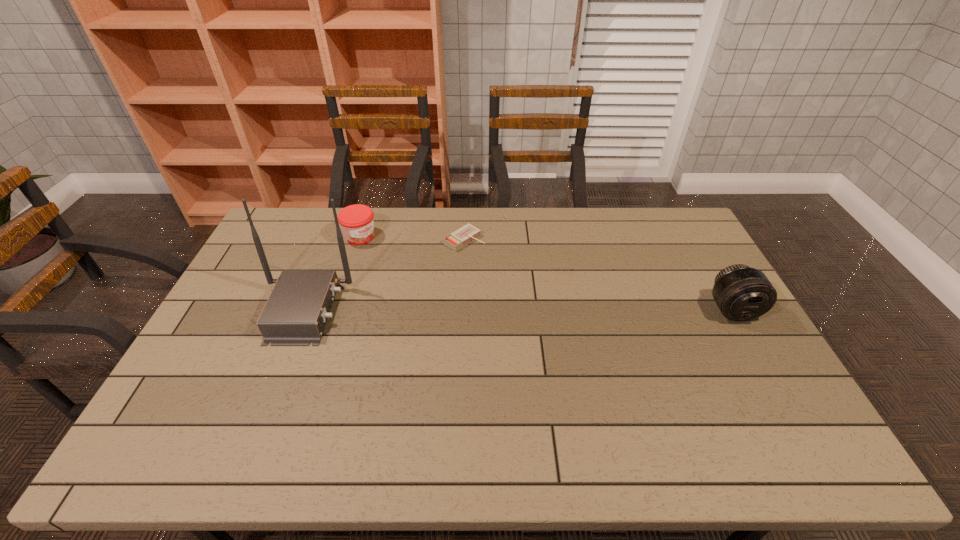
Where is `free area in between the rightmost object and the shortest object`? free area in between the rightmost object and the shortest object is located at coordinates [598, 275].

The width and height of the screenshot is (960, 540). I want to click on the third closest object to the third shortest object, so click(x=295, y=314).

Locate an element on the screen. the third closest object relative to the third tallest object is located at coordinates (742, 293).